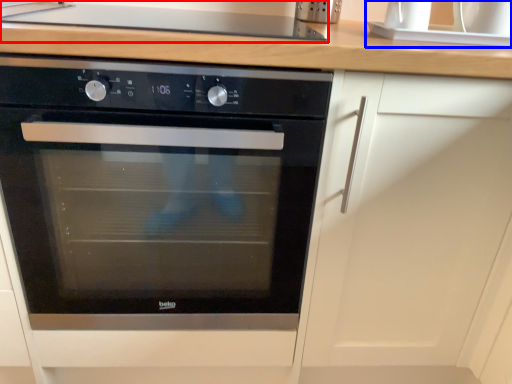
Question: Which object appears farthest to the camera in this image, gas stove (highlighted by a red box) or sink (highlighted by a blue box)?

Choices:
 (A) gas stove
 (B) sink

Answer: (B)